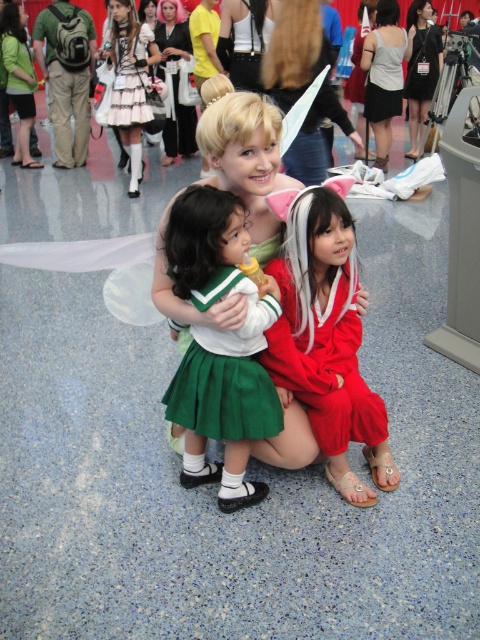
You are a photographer at the event and want to capture a photo of both the green satin skirt at center and the white lace dress at upper left. Can you see both items in the same frame without moving the camera?

Yes, because the green satin skirt at center is in front of the white lace dress at upper left, so both items are visible in the same frame.

You are a photographer at the event and need to capture a photo where both the green satin skirt at center and the white lace dress at upper left are visible. Based on their lengths, which one might you need to adjust your camera angle to ensure it is fully in frame?

The green satin skirt at center is shorter than the white lace dress at upper left, so you might need to lower your camera angle slightly to ensure the shorter green satin skirt at center is fully visible while still capturing the longer white lace dress at upper left.